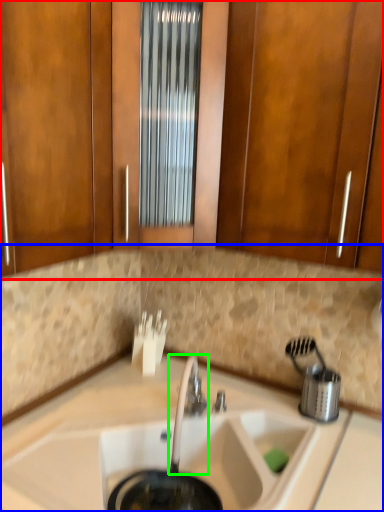
Question: Which is nearer to the cabinetry (highlighted by a red box)? countertop (highlighted by a blue box) or tap (highlighted by a green box).

Choices:
 (A) countertop
 (B) tap

Answer: (A)